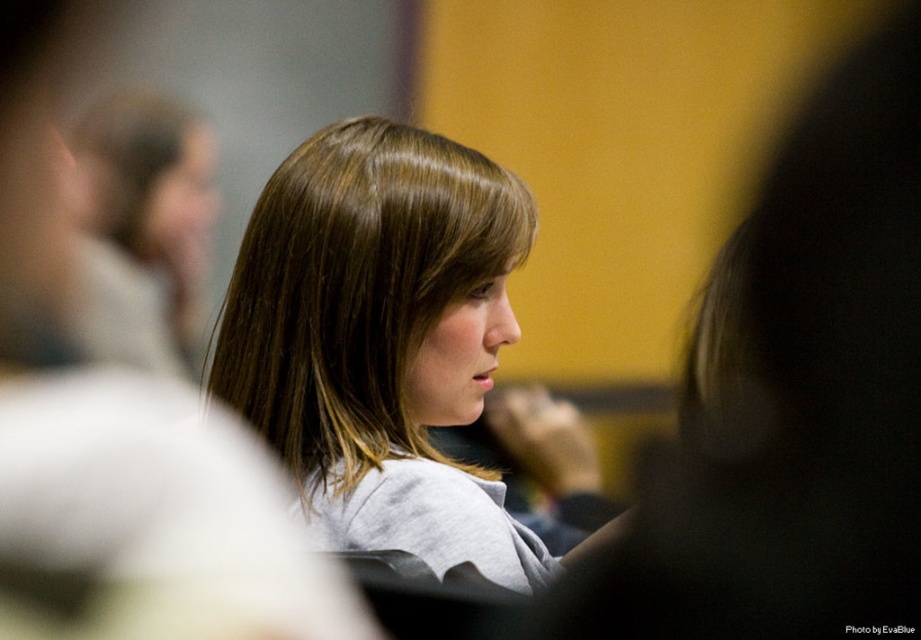
Question: Which point appears farthest from the camera in this image?

Choices:
 (A) (439, 269)
 (B) (150, 116)

Answer: (B)

Question: Is smooth brown hair at center bigger than brown smooth hair at upper left?

Choices:
 (A) yes
 (B) no

Answer: (A)

Question: Observing the image, what is the correct spatial positioning of smooth brown hair at center in reference to brown smooth hair at upper left?

Choices:
 (A) above
 (B) below

Answer: (B)

Question: Is smooth brown hair at center further to camera compared to brown smooth hair at upper left?

Choices:
 (A) no
 (B) yes

Answer: (A)

Question: Which point is closer to the camera taking this photo?

Choices:
 (A) (500, 282)
 (B) (102, 216)

Answer: (A)